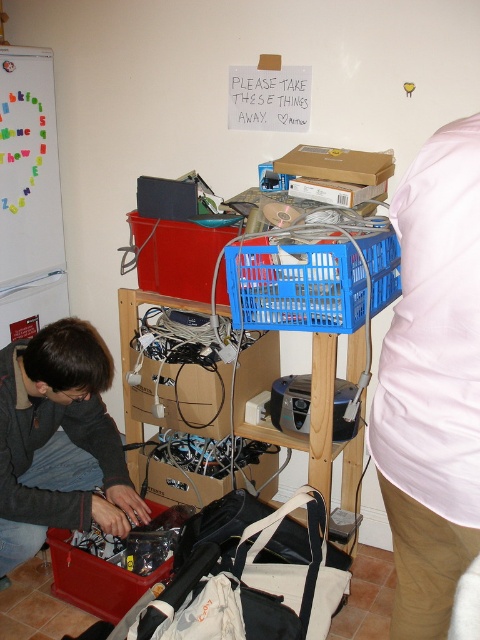
Is pink fabric shirt at upper right wider than matte plastic toolbox at lower left?

No, pink fabric shirt at upper right is not wider than matte plastic toolbox at lower left.

Is point (471, 317) closer to camera compared to point (101, 576)?

Yes, it is.

Which is in front, point (409, 605) or point (145, 588)?

Point (409, 605)

You are a GUI agent. You are given a task and a screenshot of the screen. Output one action in this format:
    pyautogui.click(x=<x>, y=<y>)
    Task: Click on the pink fabric shirt at upper right
    The height and width of the screenshot is (640, 480).
    Given the screenshot: What is the action you would take?
    pyautogui.click(x=432, y=381)

Does matte plastic crate at center appear on the left side of matte plastic toolbox at lower left?

In fact, matte plastic crate at center is to the right of matte plastic toolbox at lower left.

Does matte plastic crate at center lie in front of matte plastic toolbox at lower left?

No, it is behind matte plastic toolbox at lower left.

Between point (151, 280) and point (134, 596), which one is positioned behind?

Positioned behind is point (151, 280).

Find the location of a particular element. matte plastic crate at center is located at coordinates 176,256.

Is pink fabric shirt at upper right bigger than matte black laptop at lower left?

No.

Which of these two, pink fabric shirt at upper right or matte black laptop at lower left, stands shorter?

matte black laptop at lower left is shorter.

Find the location of a particular element. The width and height of the screenshot is (480, 640). pink fabric shirt at upper right is located at coordinates (432, 381).